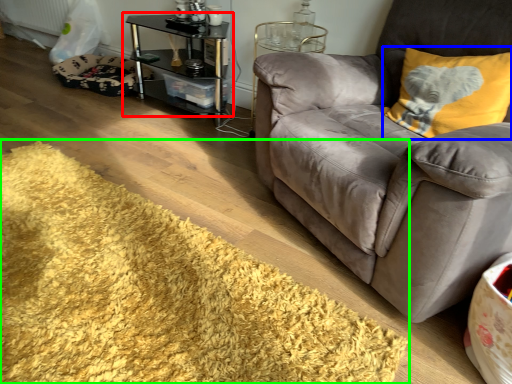
Question: Based on their relative distances, which object is farther from table (highlighted by a red box)? Choose from throw pillow (highlighted by a blue box) and mat (highlighted by a green box).

Choices:
 (A) throw pillow
 (B) mat

Answer: (A)